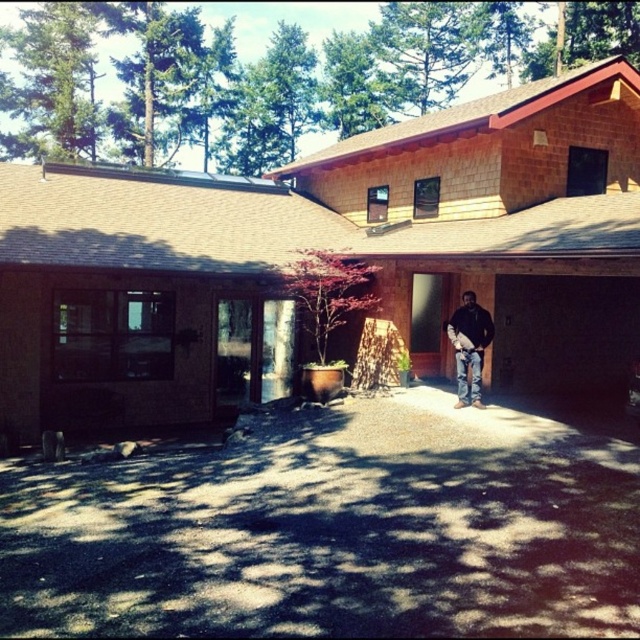
Question: Is dark asphalt driveway at center to the left of dark brown leather jacket at center from the viewer's perspective?

Choices:
 (A) no
 (B) yes

Answer: (B)

Question: Does dark asphalt driveway at center come behind dark brown leather jacket at center?

Choices:
 (A) yes
 (B) no

Answer: (B)

Question: Is dark asphalt driveway at center thinner than dark brown leather jacket at center?

Choices:
 (A) yes
 (B) no

Answer: (B)

Question: Which of the following is the closest to the observer?

Choices:
 (A) (134, 630)
 (B) (467, 349)

Answer: (A)

Question: Which object is closer to the camera taking this photo?

Choices:
 (A) dark brown leather jacket at center
 (B) brown shingles at center
 (C) dark asphalt driveway at center

Answer: (C)

Question: Which object is the closest to the dark asphalt driveway at center?

Choices:
 (A) brown shingles at center
 (B) dark brown leather jacket at center

Answer: (B)